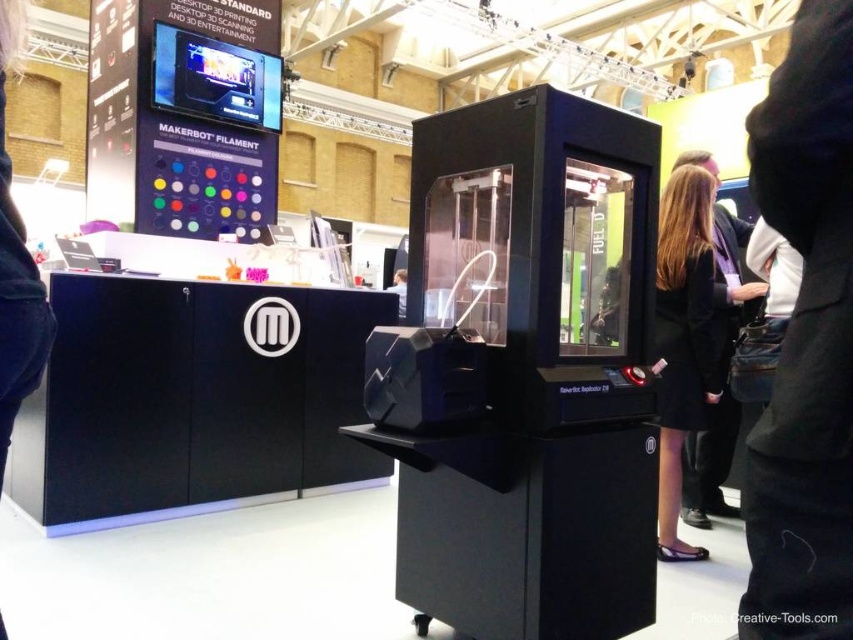
Is point (795, 93) in front of point (666, 200)?

Yes, it is.

Between black fabric pants at lower right and black fabric coat at right, which one appears on the right side from the viewer's perspective?

Positioned to the right is black fabric coat at right.

This screenshot has height=640, width=853. What do you see at coordinates (805, 342) in the screenshot? I see `black fabric pants at lower right` at bounding box center [805, 342].

Where is `black fabric pants at lower right`? black fabric pants at lower right is located at coordinates (805, 342).

Who is positioned more to the left, black fabric coat at right or black fabric coat at lower right?

Positioned to the left is black fabric coat at right.

Based on the photo, who is more forward, (659, 241) or (682, 465)?

Point (659, 241)

Where is `black fabric coat at right`? The width and height of the screenshot is (853, 640). black fabric coat at right is located at coordinates (683, 337).

Between point (811, 627) and point (703, 161), which one is positioned behind?

Point (703, 161)

Is black fabric pants at lower right taller than black fabric coat at lower right?

No, black fabric pants at lower right is not taller than black fabric coat at lower right.

Does point (758, 483) come behind point (688, 452)?

No, it is in front of (688, 452).

The width and height of the screenshot is (853, 640). Find the location of `black fabric pants at lower right`. black fabric pants at lower right is located at coordinates (805, 342).